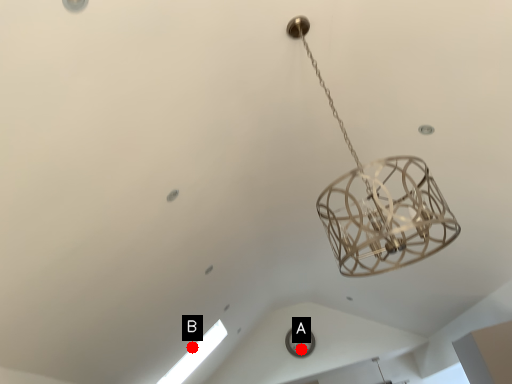
Question: Two points are circled on the image, labeled by A and B beside each circle. Among these points, which one is farthest from the camera?

Choices:
 (A) A is further
 (B) B is further

Answer: (A)